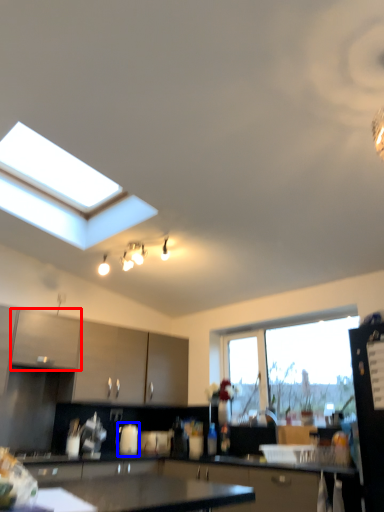
Question: Among these objects, which one is farthest to the camera, cabinetry (highlighted by a red box) or appliance (highlighted by a blue box)?

Choices:
 (A) cabinetry
 (B) appliance

Answer: (B)